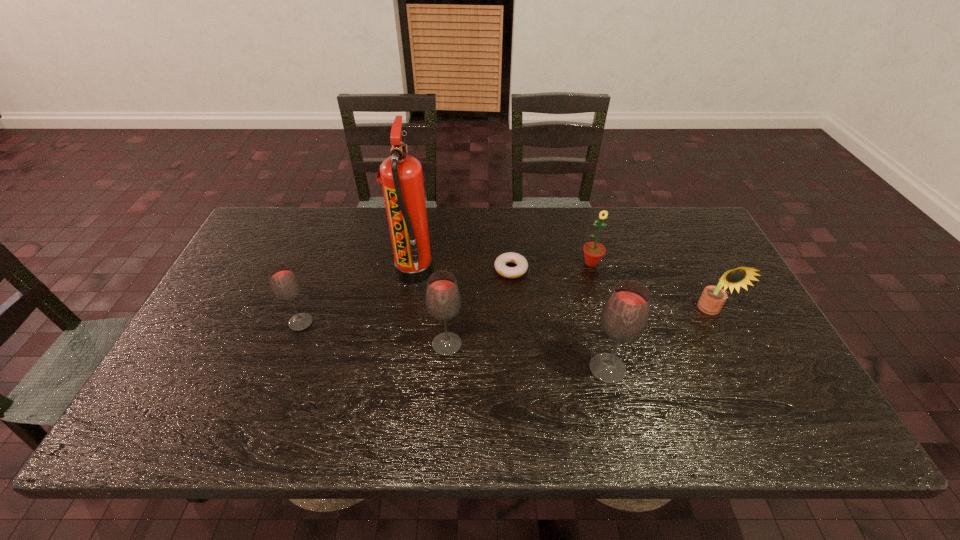
Find the location of `object that is positioned at the right edge`. object that is positioned at the right edge is located at coordinates pyautogui.click(x=712, y=299).

Where is `free space at the far edge`? The height and width of the screenshot is (540, 960). free space at the far edge is located at coordinates (644, 230).

Locate an element on the screen. This screenshot has height=540, width=960. vacant region at the left edge of the desktop is located at coordinates (261, 255).

Locate an element on the screen. This screenshot has width=960, height=540. free spot at the right edge of the desktop is located at coordinates (735, 329).

In the image, there is a desktop. Where is `vacant space at the near left corner`? The height and width of the screenshot is (540, 960). vacant space at the near left corner is located at coordinates (177, 369).

In the image, there is a desktop. Where is `vacant region at the far right corner`? vacant region at the far right corner is located at coordinates point(702,228).

Identify the location of blank space at the near right corner of the desktop. The height and width of the screenshot is (540, 960). (792, 380).

Locate an element on the screen. vacant space in between the fifth object from right to left and the nearer sunflower is located at coordinates (579, 327).

Where is `vacant space that is in between the leftmost glass drink container and the nearer sunflower`? Image resolution: width=960 pixels, height=540 pixels. vacant space that is in between the leftmost glass drink container and the nearer sunflower is located at coordinates (506, 316).

Where is `empty space that is in between the fifth object from right to left and the doughnut`? empty space that is in between the fifth object from right to left and the doughnut is located at coordinates (479, 307).